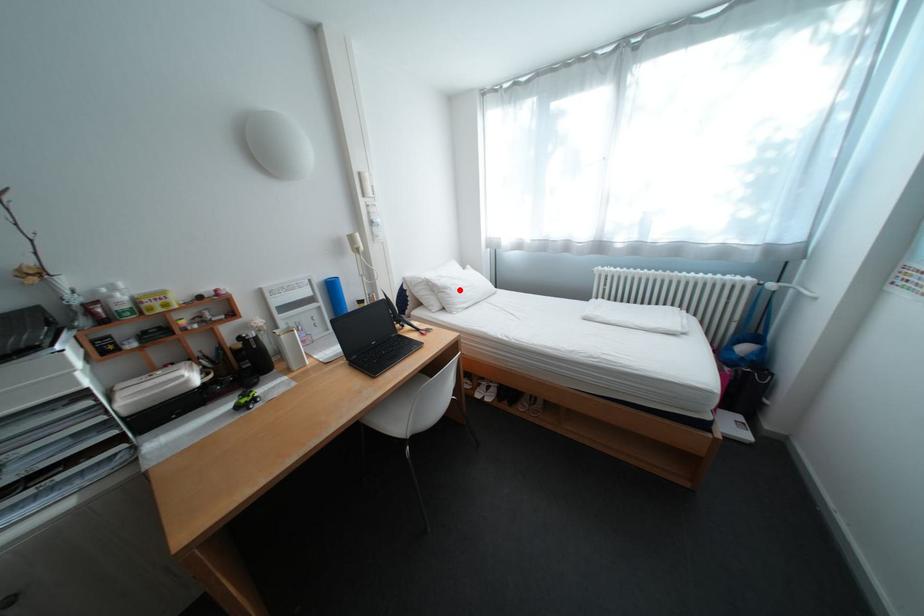
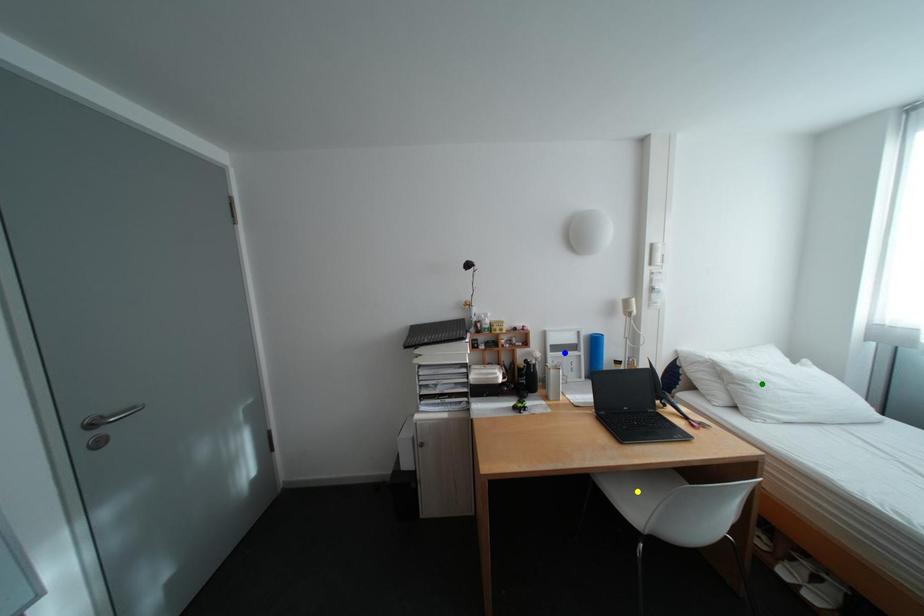
Question: I am providing you with two images of the same scene from different viewpoints. A red point is marked on the first image. You are given multiple points on the second image. In image 2, which mark is for the same physical point as the one in image 1?

Choices:
 (A) blue point
 (B) yellow point
 (C) green point

Answer: (C)